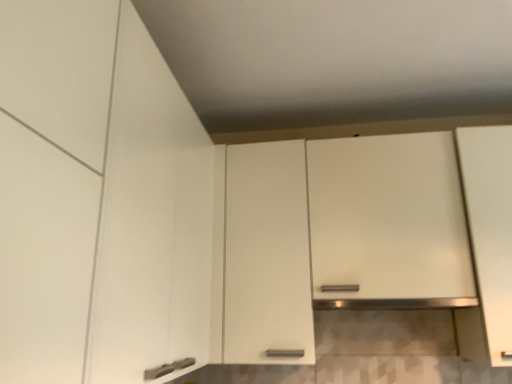
Measure the distance between white matte cabinet at left, the second cabinetry from the right, and camera.

white matte cabinet at left, the second cabinetry from the right, and camera are 21.53 inches apart from each other.

This screenshot has width=512, height=384. What do you see at coordinates (106, 191) in the screenshot?
I see `white matte cabinet at left, the second cabinetry from the right` at bounding box center [106, 191].

This screenshot has width=512, height=384. In order to click on white matte cabinet at left, the second cabinetry from the right in this screenshot , I will do `click(106, 191)`.

Where is `white matte cabinet at center, the 2th cabinetry when ordered from left to right`? white matte cabinet at center, the 2th cabinetry when ordered from left to right is located at coordinates (364, 232).

The width and height of the screenshot is (512, 384). What do you see at coordinates (364, 232) in the screenshot?
I see `white matte cabinet at center, the 2th cabinetry when ordered from left to right` at bounding box center [364, 232].

Consider the image. How much space does white matte cabinet at center, the 2th cabinetry when ordered from left to right, occupy horizontally?

The width of white matte cabinet at center, the 2th cabinetry when ordered from left to right, is 15.12 inches.

Where is `white matte cabinet at left, the second cabinetry from the right`? white matte cabinet at left, the second cabinetry from the right is located at coordinates (106, 191).

Does white matte cabinet at center, the 2th cabinetry when ordered from left to right, appear on the left side of white matte cabinet at left, the second cabinetry from the right?

No.

Which object is further away from the camera, white matte cabinet at center, acting as the first cabinetry starting from the right, or white matte cabinet at left, placed as the 1th cabinetry when sorted from left to right?

white matte cabinet at center, acting as the first cabinetry starting from the right, is further from the camera.

Which is closer, (239,161) or (189,193)?

Point (239,161) appears to be farther away from the viewer than point (189,193).

From the image's perspective, is white matte cabinet at center, the 2th cabinetry when ordered from left to right, on white matte cabinet at left, the second cabinetry from the right?

Incorrect, from the image's perspective, white matte cabinet at center, the 2th cabinetry when ordered from left to right, is lower than white matte cabinet at left, the second cabinetry from the right.

Consider the image. From a real-world perspective, is white matte cabinet at center, the 2th cabinetry when ordered from left to right, below white matte cabinet at left, placed as the 1th cabinetry when sorted from left to right?

No, from a real-world perspective, white matte cabinet at center, the 2th cabinetry when ordered from left to right, is not under white matte cabinet at left, placed as the 1th cabinetry when sorted from left to right.

Considering the sizes of objects white matte cabinet at center, acting as the first cabinetry starting from the right, and white matte cabinet at left, placed as the 1th cabinetry when sorted from left to right, in the image provided, who is wider, white matte cabinet at center, acting as the first cabinetry starting from the right, or white matte cabinet at left, placed as the 1th cabinetry when sorted from left to right,?

white matte cabinet at left, placed as the 1th cabinetry when sorted from left to right.

Which of these two, white matte cabinet at center, acting as the first cabinetry starting from the right, or white matte cabinet at left, the second cabinetry from the right, stands shorter?

Standing shorter between the two is white matte cabinet at left, the second cabinetry from the right.

Based on their sizes in the image, would you say white matte cabinet at center, the 2th cabinetry when ordered from left to right, is bigger or smaller than white matte cabinet at left, the second cabinetry from the right?

white matte cabinet at center, the 2th cabinetry when ordered from left to right, is bigger than white matte cabinet at left, the second cabinetry from the right.

Is white matte cabinet at center, the 2th cabinetry when ordered from left to right, not within white matte cabinet at left, the second cabinetry from the right?

That's correct, white matte cabinet at center, the 2th cabinetry when ordered from left to right, is outside of white matte cabinet at left, the second cabinetry from the right.

Looking at this image, is white matte cabinet at center, acting as the first cabinetry starting from the right, positioned far away from white matte cabinet at left, the second cabinetry from the right?

No, there isn't a large distance between white matte cabinet at center, acting as the first cabinetry starting from the right, and white matte cabinet at left, the second cabinetry from the right.

Is white matte cabinet at center, acting as the first cabinetry starting from the right, aimed at white matte cabinet at left, the second cabinetry from the right?

Yes, white matte cabinet at center, acting as the first cabinetry starting from the right, is turned towards white matte cabinet at left, the second cabinetry from the right.

Based on the photo, how many degrees apart are the facing directions of white matte cabinet at center, acting as the first cabinetry starting from the right, and white matte cabinet at left, the second cabinetry from the right?

The angle between the facing direction of white matte cabinet at center, acting as the first cabinetry starting from the right, and the facing direction of white matte cabinet at left, the second cabinetry from the right, is 0.0119 degrees.

Where is `cabinetry above the white matte cabinet at center, acting as the first cabinetry starting from the right (from the image's perspective)`? Image resolution: width=512 pixels, height=384 pixels. cabinetry above the white matte cabinet at center, acting as the first cabinetry starting from the right (from the image's perspective) is located at coordinates (106, 191).

Considering the relative positions of white matte cabinet at left, the second cabinetry from the right, and white matte cabinet at center, acting as the first cabinetry starting from the right, in the image provided, is white matte cabinet at left, the second cabinetry from the right, to the left of white matte cabinet at center, acting as the first cabinetry starting from the right, from the viewer's perspective?

Indeed, white matte cabinet at left, the second cabinetry from the right, is positioned on the left side of white matte cabinet at center, acting as the first cabinetry starting from the right.

Is white matte cabinet at left, placed as the 1th cabinetry when sorted from left to right, positioned before white matte cabinet at center, the 2th cabinetry when ordered from left to right?

Yes.

Is point (138, 352) farther from viewer compared to point (358, 146)?

No, it is not.

From the image's perspective, which one is positioned lower, white matte cabinet at left, the second cabinetry from the right, or white matte cabinet at center, acting as the first cabinetry starting from the right?

white matte cabinet at center, acting as the first cabinetry starting from the right.

Based on the photo, from a real-world perspective, is white matte cabinet at left, the second cabinetry from the right, beneath white matte cabinet at center, acting as the first cabinetry starting from the right?

Yes, from a real-world perspective, white matte cabinet at left, the second cabinetry from the right, is below white matte cabinet at center, acting as the first cabinetry starting from the right.

Considering the relative sizes of white matte cabinet at left, the second cabinetry from the right, and white matte cabinet at center, acting as the first cabinetry starting from the right, in the image provided, is white matte cabinet at left, the second cabinetry from the right, thinner than white matte cabinet at center, acting as the first cabinetry starting from the right,?

In fact, white matte cabinet at left, the second cabinetry from the right, might be wider than white matte cabinet at center, acting as the first cabinetry starting from the right.

Does white matte cabinet at left, placed as the 1th cabinetry when sorted from left to right, have a lesser height compared to white matte cabinet at center, the 2th cabinetry when ordered from left to right?

Correct, white matte cabinet at left, placed as the 1th cabinetry when sorted from left to right, is not as tall as white matte cabinet at center, the 2th cabinetry when ordered from left to right.

From the picture: Considering the sizes of objects white matte cabinet at left, placed as the 1th cabinetry when sorted from left to right, and white matte cabinet at center, the 2th cabinetry when ordered from left to right, in the image provided, who is smaller, white matte cabinet at left, placed as the 1th cabinetry when sorted from left to right, or white matte cabinet at center, the 2th cabinetry when ordered from left to right,?

white matte cabinet at left, placed as the 1th cabinetry when sorted from left to right, is smaller.

Would you say white matte cabinet at center, the 2th cabinetry when ordered from left to right, is part of white matte cabinet at left, the second cabinetry from the right,'s contents?

Actually, white matte cabinet at center, the 2th cabinetry when ordered from left to right, is outside white matte cabinet at left, the second cabinetry from the right.

Is white matte cabinet at left, the second cabinetry from the right, not close to white matte cabinet at center, the 2th cabinetry when ordered from left to right?

No, white matte cabinet at left, the second cabinetry from the right, is not far away from white matte cabinet at center, the 2th cabinetry when ordered from left to right.

Is white matte cabinet at left, placed as the 1th cabinetry when sorted from left to right, looking in the opposite direction of white matte cabinet at center, acting as the first cabinetry starting from the right?

white matte cabinet at left, placed as the 1th cabinetry when sorted from left to right, does not have its back to white matte cabinet at center, acting as the first cabinetry starting from the right.

From the picture: What's the angular difference between white matte cabinet at left, placed as the 1th cabinetry when sorted from left to right, and white matte cabinet at center, acting as the first cabinetry starting from the right,'s facing directions?

There is a 0.0119-degree angle between the facing directions of white matte cabinet at left, placed as the 1th cabinetry when sorted from left to right, and white matte cabinet at center, acting as the first cabinetry starting from the right.

Could you measure the distance between white matte cabinet at left, placed as the 1th cabinetry when sorted from left to right, and white matte cabinet at center, acting as the first cabinetry starting from the right?

white matte cabinet at left, placed as the 1th cabinetry when sorted from left to right, and white matte cabinet at center, acting as the first cabinetry starting from the right, are 81.05 centimeters apart from each other.

Image resolution: width=512 pixels, height=384 pixels. What are the coordinates of `cabinetry that appears above the white matte cabinet at center, acting as the first cabinetry starting from the right (from the image's perspective)` in the screenshot? It's located at (106, 191).

Find the location of a particular element. This screenshot has width=512, height=384. cabinetry below the white matte cabinet at center, the 2th cabinetry when ordered from left to right (from a real-world perspective) is located at coordinates (106, 191).

The image size is (512, 384). What are the coordinates of `cabinetry that is above the white matte cabinet at left, the second cabinetry from the right (from a real-world perspective)` in the screenshot? It's located at (364, 232).